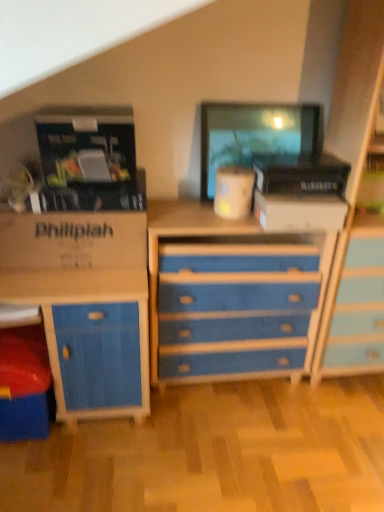
Question: In the image, is blue painted wood chest of drawers at center positioned in front of or behind white cardboard box at center?

Choices:
 (A) front
 (B) behind

Answer: (A)

Question: Considering the positions of point (299, 242) and point (256, 188), is point (299, 242) closer or farther from the camera than point (256, 188)?

Choices:
 (A) farther
 (B) closer

Answer: (A)

Question: Which of these objects is positioned closest to the blue painted wood chest of drawers at center?

Choices:
 (A) matte black monitor at upper center
 (B) white cardboard box at center
 (C) brown cardboard box at left

Answer: (B)

Question: Which object is positioned farthest from the blue painted wood chest of drawers at center?

Choices:
 (A) white cardboard box at center
 (B) matte black monitor at upper center
 (C) brown cardboard box at left

Answer: (B)